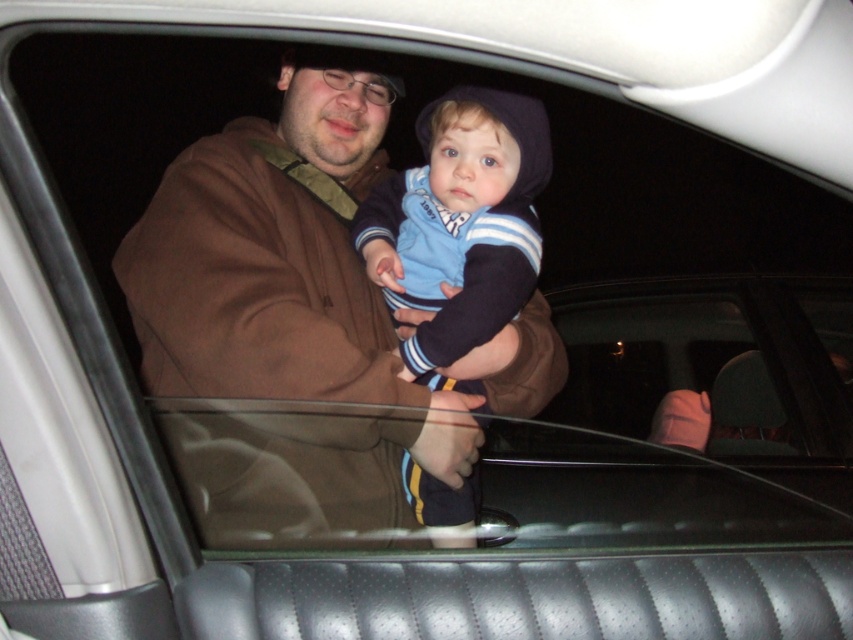
You are standing 5 feet away from a point marked at coordinates (415, 412) in a car at night. Can you safely reach that point without moving your feet?

The point at (415, 412) is 5.31 feet away from you, so you can safely reach it without moving your feet since it is within your 5 feet range.

You are a passenger in the car and want to know which of the two points, point (192,388) or point (494,109), is closer to you. Based on the scene description, which point is nearer?

Point (192,388) is closer to the camera than point (494,109), so it is nearer to you as a passenger in the car.

You are a fashion designer observing the car scene. You need to decide which clothing item, the brown fleece jacket at center or the blue striped sweater at center, would require more fabric to produce. Which one would it be?

The brown fleece jacket at center has a larger size compared to the blue striped sweater at center, so it would require more fabric to produce.